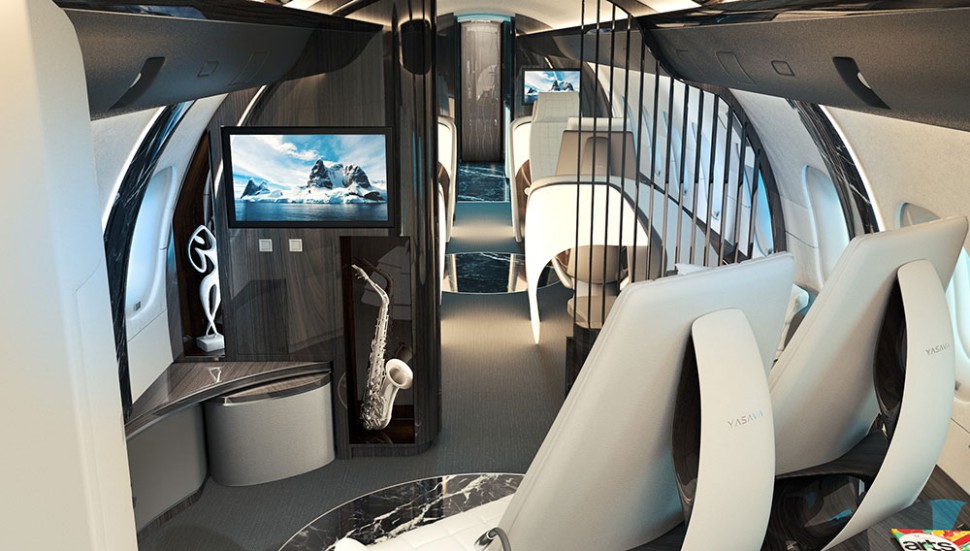
Where is `black and white marble table`? Image resolution: width=970 pixels, height=551 pixels. black and white marble table is located at coordinates (431, 515).